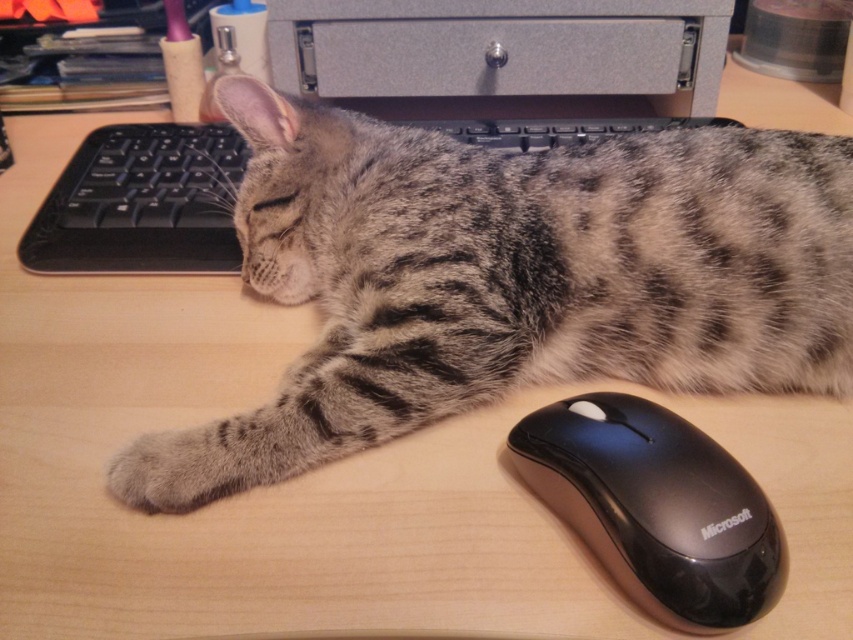
You are a photographer standing in front of the desk. You want to take a photo of the cat and the two points mentioned. Which point is closer to the camera, point (663, 52) or point (183, 164)?

Point (663, 52) is further to the viewer than point (183, 164), so the point closer to the camera is point (183, 164).

You are a delivery person who needs to place a small package on the desk without waking the sleeping cat. The package must be placed in an area that is closest to the metallic gray computer at upper center. Where should you place the package?

The metallic gray computer at upper center is located at point (502, 54), so you should place the package near that coordinate to be closest to it without disturbing the cat.

You are a photographer trying to take a photo of the gray striped fur cat at center and the black plastic keyboard at upper center. Since the cat is sleeping, you need to ensure the camera is placed at a height that can capture both objects without disturbing the cat. Based on their heights, where should you position the camera?

The gray striped fur cat at center is much taller than the black plastic keyboard at upper center, so you should position the camera at a height that can see over the cat to also capture the keyboard below it.